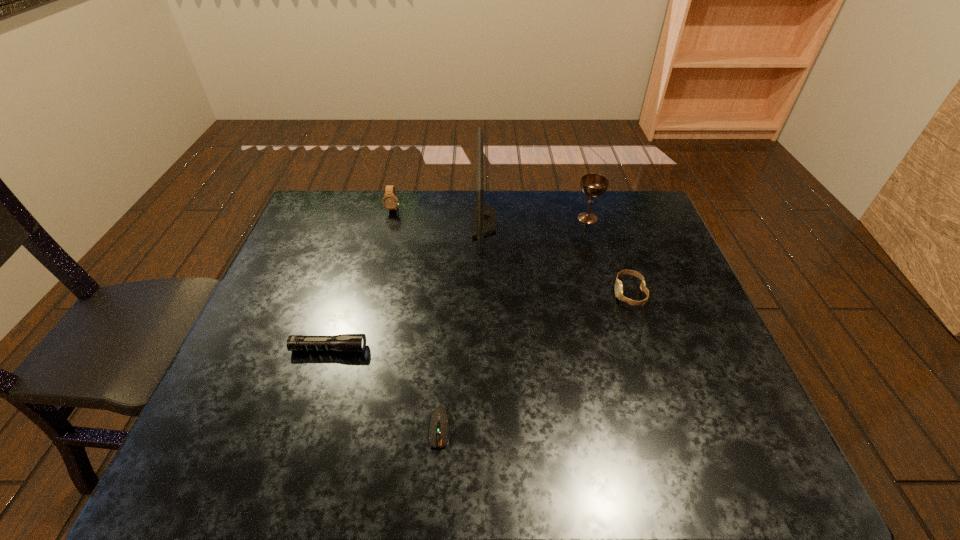
Select which object appears as the closest to the chalice. Please provide its 2D coordinates. Your answer should be formatted as a tuple, i.e. [(x, y)], where the tuple contains the x and y coordinates of a point satisfying the conditions above.

[(618, 284)]

Where is `object that stands as the closest to the computer equipment`? This screenshot has width=960, height=540. object that stands as the closest to the computer equipment is located at coordinates (344, 342).

Find the location of a particular element. vacant area in the image that satisfies the following two spatial constraints: 1. on the face of the third nearest object; 2. on the button of the shortest object is located at coordinates (675, 428).

The image size is (960, 540). Identify the location of blank space that satisfies the following two spatial constraints: 1. on the face of the fourth farthest object; 2. on the button of the shortest object. (675, 428).

Locate an element on the screen. This screenshot has width=960, height=540. vacant space that satisfies the following two spatial constraints: 1. on the face of the fourth shortest object; 2. at the lens end of the flashlight is located at coordinates (359, 349).

I want to click on vacant space that satisfies the following two spatial constraints: 1. on the screen side of the monitor; 2. on the button of the shortest object, so click(487, 428).

What are the coordinates of `vacant space that satisfies the following two spatial constraints: 1. on the face of the left watch; 2. at the lens end of the fifth farthest object` in the screenshot? It's located at (359, 349).